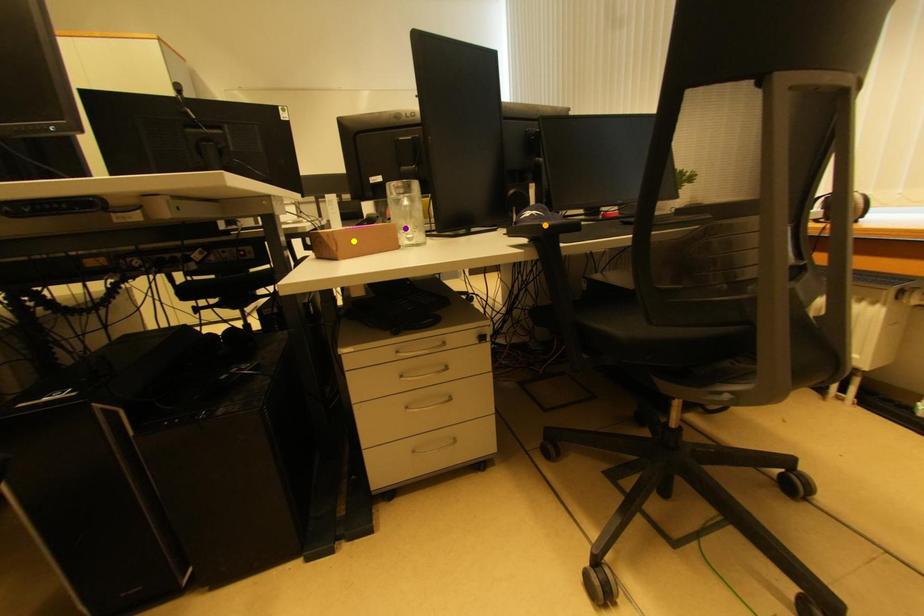
Order these from nearest to farthest:
purple point
yellow point
orange point

orange point
yellow point
purple point